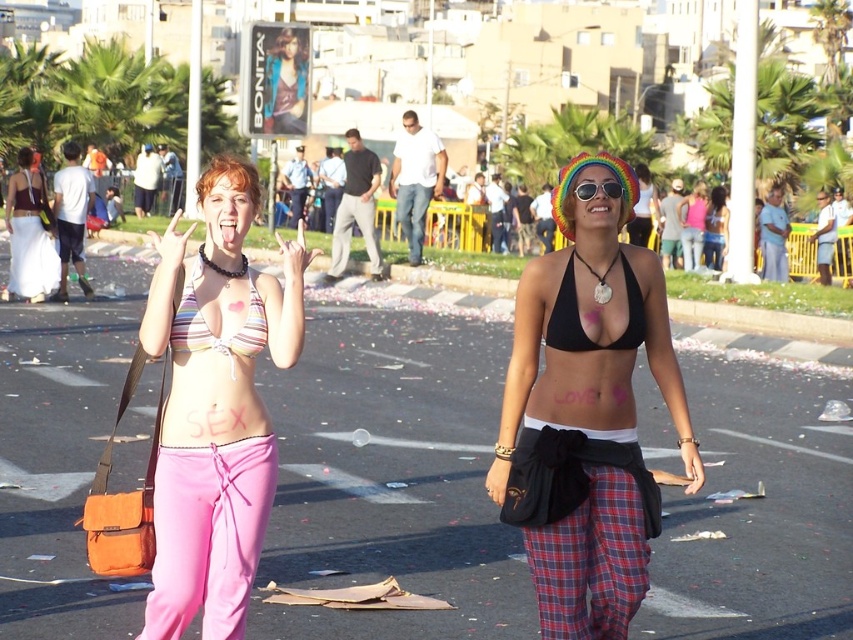
Based on the scene description, which object is closer to the observer between the black fabric bikini top at center and the matte black bikini top at center?

The black fabric bikini top at center is closer to the observer because it is in front of the matte black bikini top at center.